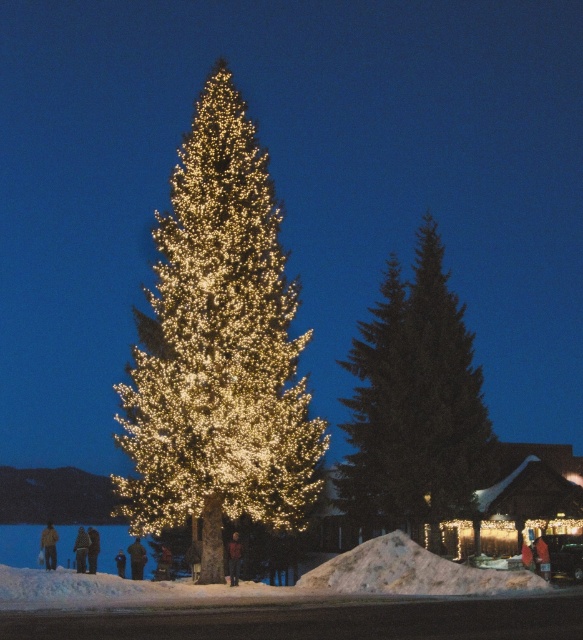
Is dark brown fur coat at lower left to the left of black fabric person at lower left from the viewer's perspective?

Yes, dark brown fur coat at lower left is to the left of black fabric person at lower left.

Between point (87, 532) and point (114, 557), which one is positioned in front?

Point (87, 532) is more forward.

Where is `dark brown fur coat at lower left`? dark brown fur coat at lower left is located at coordinates (93, 548).

Can you confirm if illuminated gold christmas tree at center is positioned to the left of dark brown fur coat at lower left?

No, illuminated gold christmas tree at center is not to the left of dark brown fur coat at lower left.

Can you confirm if illuminated gold christmas tree at center is bigger than dark brown fur coat at lower left?

Yes.

Where is `illuminated gold christmas tree at center`? Image resolution: width=583 pixels, height=640 pixels. illuminated gold christmas tree at center is located at coordinates (217, 348).

Does green matte evergreen tree at center appear on the right side of dark brown leather jacket at lower center?

Indeed, green matte evergreen tree at center is positioned on the right side of dark brown leather jacket at lower center.

Which is in front, point (405, 396) or point (138, 547)?

Positioned in front is point (405, 396).

The width and height of the screenshot is (583, 640). Describe the element at coordinates (415, 401) in the screenshot. I see `green matte evergreen tree at center` at that location.

Where is `green matte evergreen tree at center`? green matte evergreen tree at center is located at coordinates (415, 401).